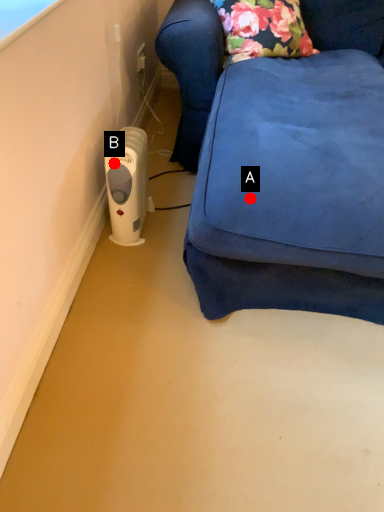
Question: Two points are circled on the image, labeled by A and B beside each circle. Which point appears closest to the camera in this image?

Choices:
 (A) A is closer
 (B) B is closer

Answer: (A)